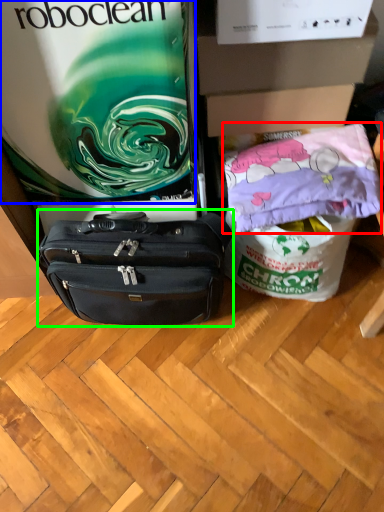
Question: Considering the real-world distances, which object is farthest from material (highlighted by a red box)? gift bag (highlighted by a blue box) or luggage and bags (highlighted by a green box)?

Choices:
 (A) gift bag
 (B) luggage and bags

Answer: (A)